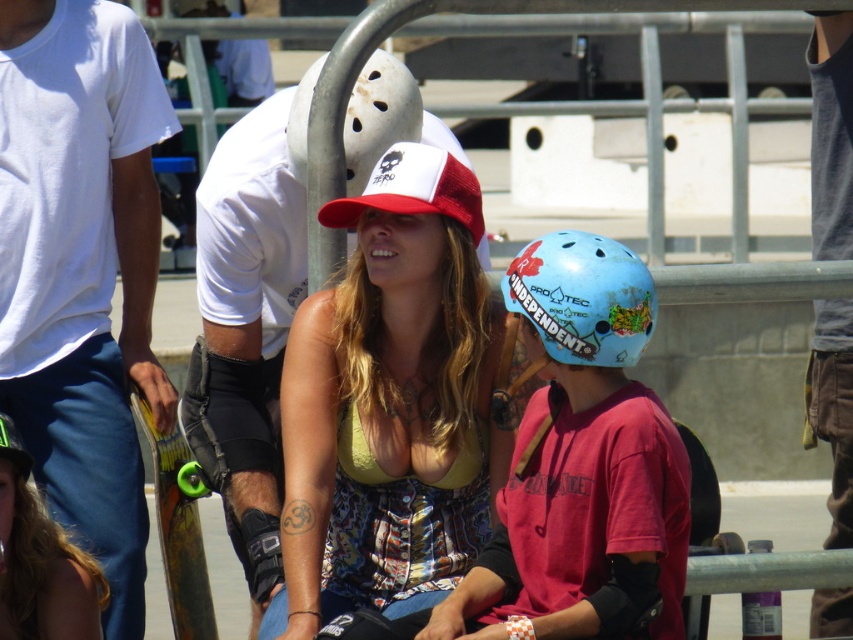
You are a photographer standing at the back of the scene. You want to take a photo that includes both the matte yellow tank top at center and the multicolored fabric top at center. The camera has a maximum focus range of 5 feet. Can you capture both subjects in focus without moving your position?

The matte yellow tank top at center is 4.79 feet from the multicolored fabric top at center. Since the distance between them is within the camera maximum focus range of 5 feet, you can capture both subjects in focus without moving your position.

You are a photographer trying to capture a photo of the green rubber skateboard at lower left and the white matte helmet at upper center. Which object should you adjust your camera to focus on first if you want to capture both in the same frame without moving your position?

You should focus on the green rubber skateboard at lower left first because the white matte helmet at upper center is to the right of it, so adjusting from left to right will ensure both are in frame.

You are a photographer at the skate park and want to capture both the matte yellow tank top at center and the multicolored fabric top at center in the same frame. Which one is positioned higher in the image?

The matte yellow tank top at center is positioned higher in the image than the multicolored fabric top at center.